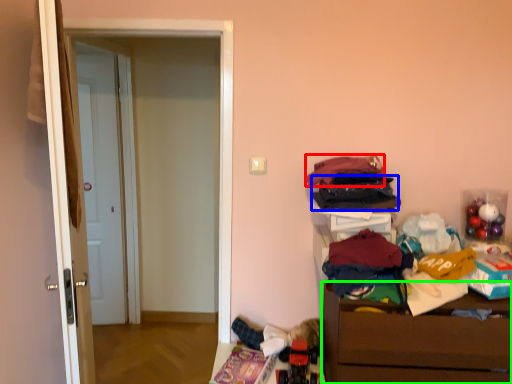
Question: Which object is the closest to the clothing (highlighted by a red box)? Choose among these: clothing (highlighted by a blue box) or chest of drawers (highlighted by a green box).

Choices:
 (A) clothing
 (B) chest of drawers

Answer: (A)